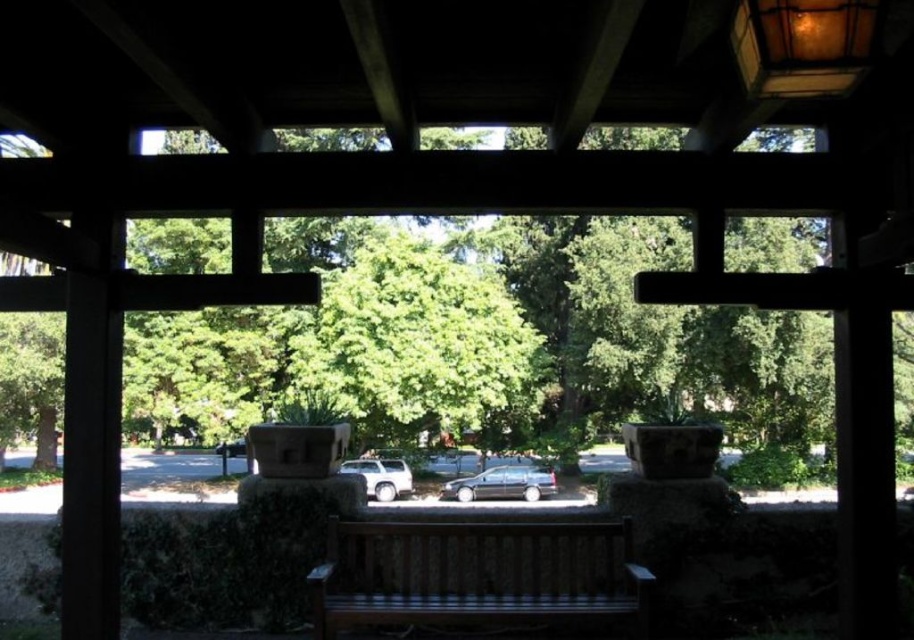
Does green leafy tree at center have a greater width compared to wooden bench at center?

Yes, green leafy tree at center is wider than wooden bench at center.

Who is positioned more to the left, green leafy tree at center or wooden bench at center?

Positioned to the left is green leafy tree at center.

The image size is (914, 640). I want to click on green leafy tree at center, so click(x=418, y=342).

Can you confirm if green leafy tree at center is positioned to the right of metallic gray car at center?

In fact, green leafy tree at center is to the left of metallic gray car at center.

Is point (473, 396) closer to camera compared to point (525, 484)?

That is True.

You are a GUI agent. You are given a task and a screenshot of the screen. Output one action in this format:
    pyautogui.click(x=<x>, y=<y>)
    Task: Click on the green leafy tree at center
    
    Given the screenshot: What is the action you would take?
    pyautogui.click(x=418, y=342)

Can you confirm if wooden bench at center is thinner than matte silver suv at center?

Correct, wooden bench at center's width is less than matte silver suv at center's.

Does point (358, 554) lie in front of point (363, 472)?

That is True.

The image size is (914, 640). I want to click on wooden bench at center, so click(476, 573).